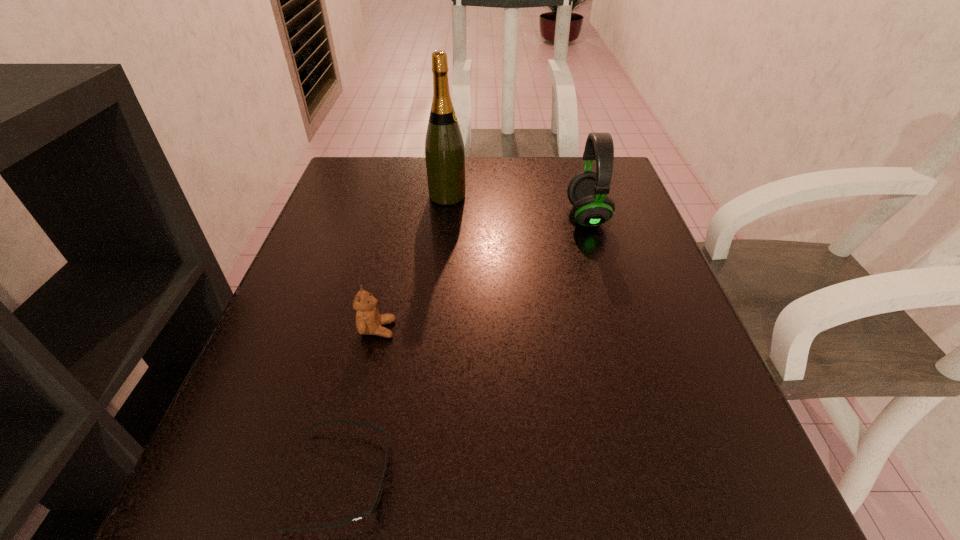
Find the location of a particular element. This screenshot has height=540, width=960. the tallest object is located at coordinates (444, 148).

I want to click on headset, so click(x=587, y=191).

Where is `the rightmost object`? the rightmost object is located at coordinates (587, 191).

You are a GUI agent. You are given a task and a screenshot of the screen. Output one action in this format:
    pyautogui.click(x=<x>, y=<y>)
    Task: Click on the teddy bear
    
    Given the screenshot: What is the action you would take?
    pyautogui.click(x=368, y=320)

Identify the location of the third tallest object. This screenshot has width=960, height=540. (368, 320).

Where is `the shortest object`? Image resolution: width=960 pixels, height=540 pixels. the shortest object is located at coordinates (381, 480).

Image resolution: width=960 pixels, height=540 pixels. Find the location of `the nearest object`. the nearest object is located at coordinates tap(381, 480).

Locate an element on the screen. vacant space located 0.300m on the front-facing side of the wine bottle is located at coordinates (587, 196).

Locate an element on the screen. vacant space located on the ear cups of the rightmost object is located at coordinates (444, 216).

Find the location of a particular element. The width and height of the screenshot is (960, 540). vacant space situated on the ear cups of the rightmost object is located at coordinates (478, 216).